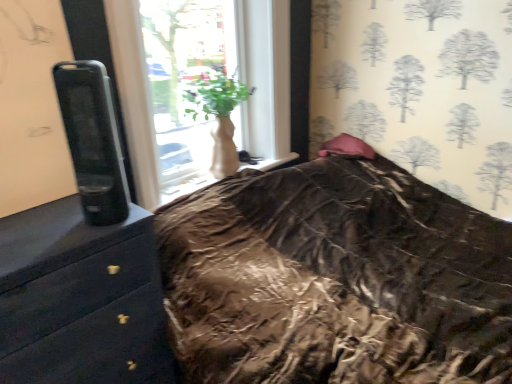
Question: Can you confirm if white matte vase at center is wider than black glossy chest of drawers at left?

Choices:
 (A) yes
 (B) no

Answer: (B)

Question: Is white matte vase at center at the right side of black glossy chest of drawers at left?

Choices:
 (A) no
 (B) yes

Answer: (B)

Question: Is white matte vase at center outside black glossy chest of drawers at left?

Choices:
 (A) no
 (B) yes

Answer: (B)

Question: From the image's perspective, is white matte vase at center on black glossy chest of drawers at left?

Choices:
 (A) no
 (B) yes

Answer: (B)

Question: Is white matte vase at center positioned before black glossy chest of drawers at left?

Choices:
 (A) yes
 (B) no

Answer: (B)

Question: Is white matte vase at center taller than black glossy chest of drawers at left?

Choices:
 (A) no
 (B) yes

Answer: (A)

Question: Is pink satin pillow at upper right turned away from white matte vase at center?

Choices:
 (A) no
 (B) yes

Answer: (A)

Question: Is white matte vase at center a part of pink satin pillow at upper right?

Choices:
 (A) no
 (B) yes

Answer: (A)

Question: Is pink satin pillow at upper right taller than white matte vase at center?

Choices:
 (A) yes
 (B) no

Answer: (B)

Question: Does pink satin pillow at upper right have a lesser height compared to white matte vase at center?

Choices:
 (A) yes
 (B) no

Answer: (A)

Question: Does pink satin pillow at upper right appear on the left side of white matte vase at center?

Choices:
 (A) no
 (B) yes

Answer: (A)

Question: Is pink satin pillow at upper right located outside white matte vase at center?

Choices:
 (A) no
 (B) yes

Answer: (B)

Question: Is white matte vase at center outside of pink satin pillow at upper right?

Choices:
 (A) yes
 (B) no

Answer: (A)